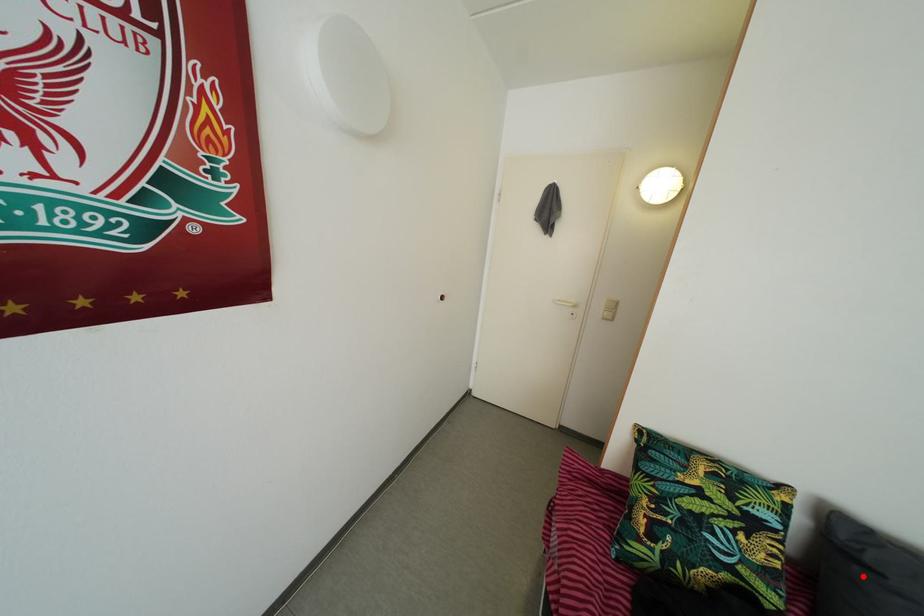
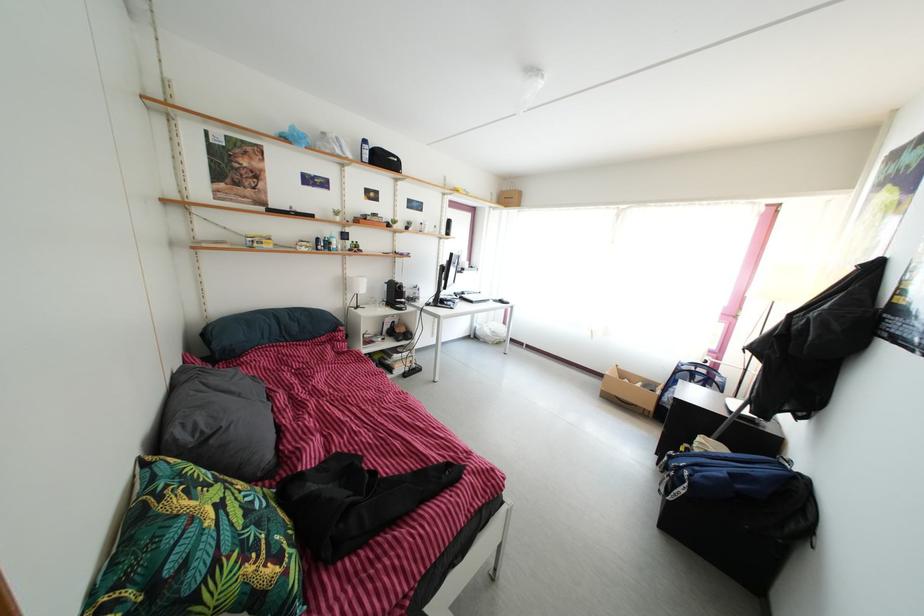
The point at the highlighted location is marked in the first image. Where is the corresponding point in the second image?

(217, 450)